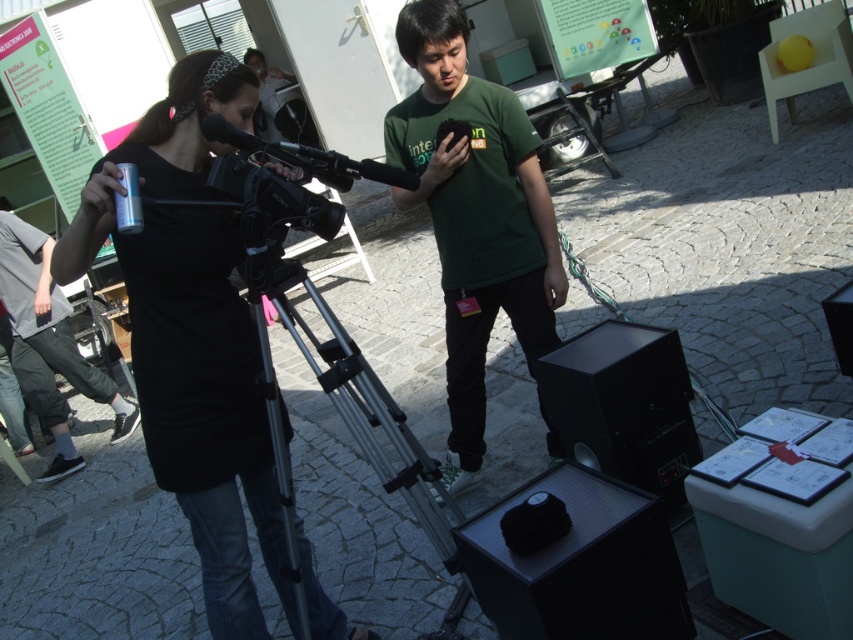
Between matte black camera at center and dark gray pants at lower left, which one appears on the left side from the viewer's perspective?

dark gray pants at lower left

Is matte black camera at center positioned at the back of dark gray pants at lower left?

No, matte black camera at center is closer to the viewer.

Identify the location of matte black camera at center. This screenshot has height=640, width=853. (194, 337).

Is matte black camera at center taller than silver metallic tripod at center?

Yes.

Does matte black camera at center have a lesser width compared to silver metallic tripod at center?

No, matte black camera at center is not thinner than silver metallic tripod at center.

This screenshot has height=640, width=853. What do you see at coordinates (194, 337) in the screenshot?
I see `matte black camera at center` at bounding box center [194, 337].

Identify the location of matte black camera at center. (194, 337).

Does silver metallic tripod at center have a greater width compared to dark gray pants at lower left?

No, silver metallic tripod at center is not wider than dark gray pants at lower left.

Does point (401, 456) come in front of point (49, 278)?

Yes, it is in front of point (49, 278).

Does point (341, 348) lie behind point (22, 244)?

That is False.

This screenshot has width=853, height=640. I want to click on silver metallic tripod at center, so coord(363,412).